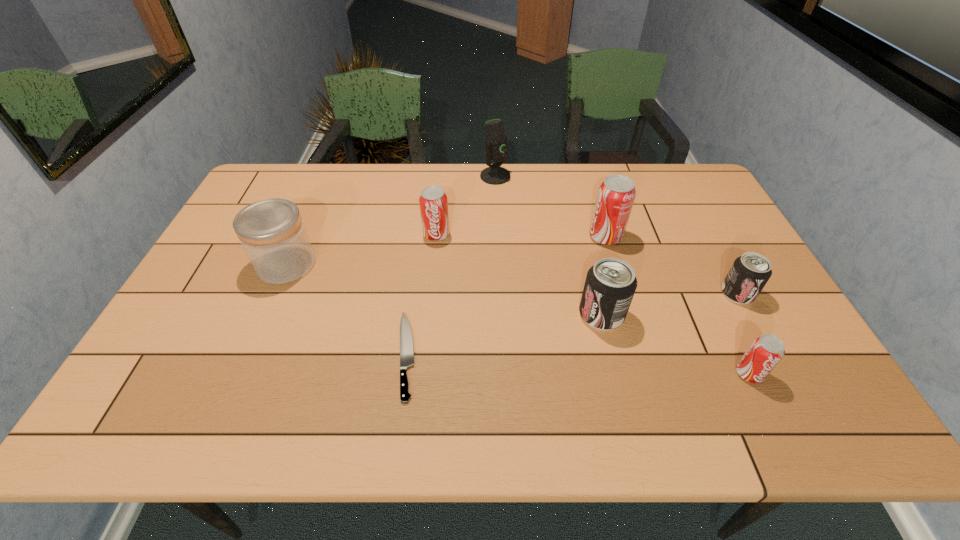
I want to click on vacant space at the near left corner of the desktop, so click(145, 403).

At what (x,y) coordinates should I click in order to perform the action: click on vacant point located between the jar and the smaller black soda can. Please return your answer as a coordinate pair (x, y). The image size is (960, 540). Looking at the image, I should click on (512, 279).

At what (x,y) coordinates should I click in order to perform the action: click on vacant area that lies between the leftmost object and the bigger black soda can. Please return your answer as a coordinate pair (x, y). Looking at the image, I should click on (444, 289).

The image size is (960, 540). Identify the location of vacant space that is in between the biggest red soda can and the leftmost red soda can. 521,235.

Identify the location of free space between the jar and the leftmost red soda can. The image size is (960, 540). (x=361, y=249).

The width and height of the screenshot is (960, 540). Find the location of `empty location between the shortest object and the second red soda can from right to left`. empty location between the shortest object and the second red soda can from right to left is located at coordinates (506, 296).

In order to click on free space that is in between the fifth object from right to left and the left black soda can in this screenshot , I will do `click(548, 245)`.

Where is `free space between the leftmost object and the nearest soda can`? Image resolution: width=960 pixels, height=540 pixels. free space between the leftmost object and the nearest soda can is located at coordinates [517, 319].

This screenshot has height=540, width=960. I want to click on free space between the shortest object and the leftmost soda can, so click(421, 295).

Choose which object is the second nearest neighbor to the nearest soda can. Please provide its 2D coordinates. Your answer should be formatted as a tuple, i.e. [(x, y)], where the tuple contains the x and y coordinates of a point satisfying the conditions above.

[(610, 284)]